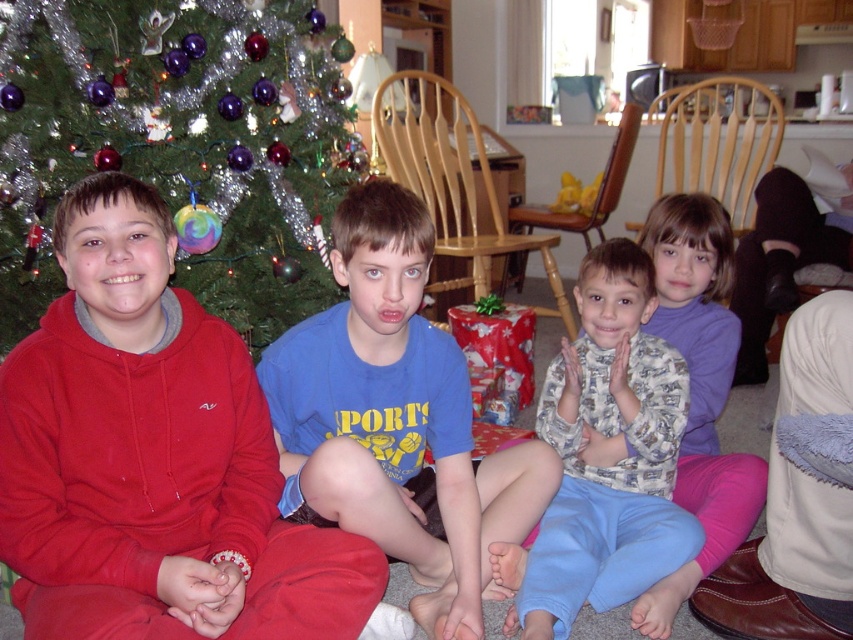
Question: Which point appears farthest from the camera in this image?

Choices:
 (A) (134, 376)
 (B) (682, 515)

Answer: (B)

Question: Which object appears farthest from the camera in this image?

Choices:
 (A) blue cotton shirt at center
 (B) purple fleece shirt at center

Answer: (B)

Question: Is shiny green tree at left bigger than printed cotton shirt at center?

Choices:
 (A) yes
 (B) no

Answer: (A)

Question: Does blue cotton shirt at center have a smaller size compared to purple fleece shirt at center?

Choices:
 (A) no
 (B) yes

Answer: (A)

Question: Can you confirm if shiny green tree at left is smaller than printed cotton shirt at center?

Choices:
 (A) yes
 (B) no

Answer: (B)

Question: Which object appears farthest from the camera in this image?

Choices:
 (A) purple fleece shirt at center
 (B) matte red hoodie at left
 (C) shiny green tree at left

Answer: (C)